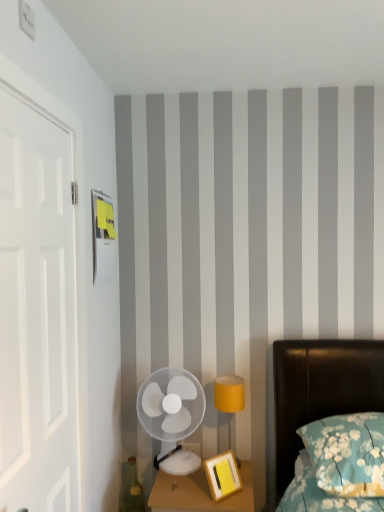
Question: Is teal floral pillow at lower right spatially inside matte yellow lampshade at right, or outside of it?

Choices:
 (A) inside
 (B) outside

Answer: (B)

Question: Considering the positions of teal floral pillow at lower right and matte yellow lampshade at right in the image, is teal floral pillow at lower right bigger or smaller than matte yellow lampshade at right?

Choices:
 (A) small
 (B) big

Answer: (B)

Question: Estimate the real-world distances between objects in this image. Which object is farther from the white matte door at left?

Choices:
 (A) teal glass bottle at lower left
 (B) matte yellow lampshade at right
 (C) teal floral pillow at lower right
 (D) white plastic fan at lower left
 (E) wooden nightstand at lower center

Answer: (C)

Question: Which is nearer to the white plastic fan at lower left?

Choices:
 (A) teal glass bottle at lower left
 (B) wooden nightstand at lower center
 (C) white matte door at left
 (D) teal floral pillow at lower right
 (E) matte yellow lampshade at right

Answer: (E)